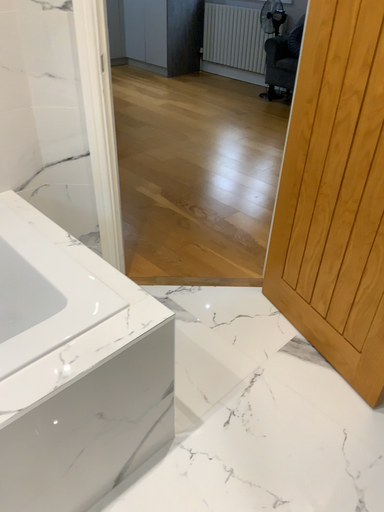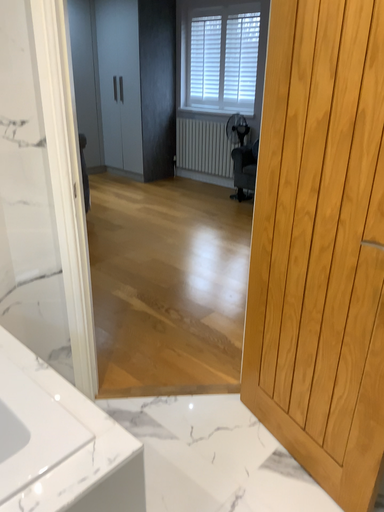
Question: Which way did the camera rotate in the video?

Choices:
 (A) rotated upward
 (B) rotated downward

Answer: (A)